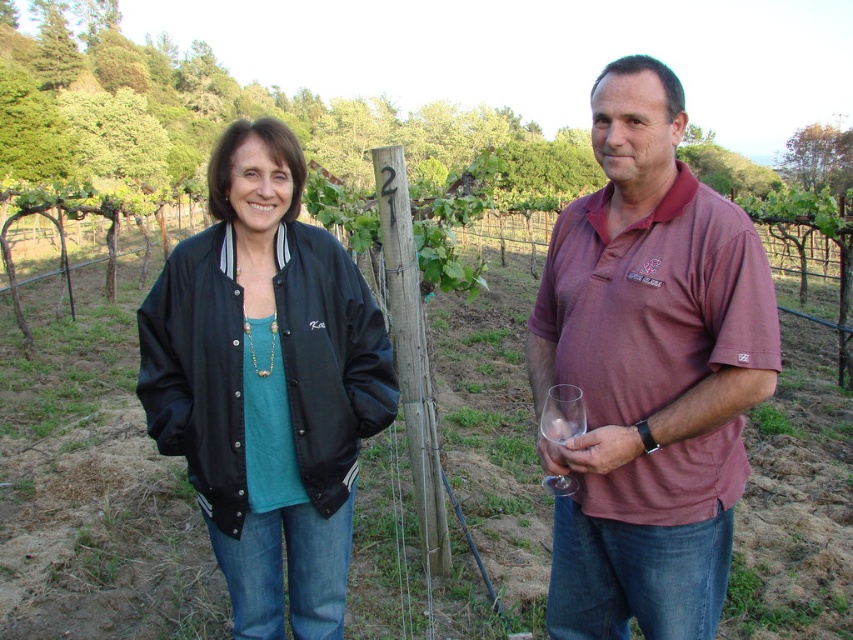
You are standing at the point with coordinates point (170, 332) and want to walk to the point with coordinates point (630, 348). According to the scene, will you need to walk towards the foreground or the background?

You need to walk towards the background because point (630, 348) is in front of point (170, 332), meaning it is closer to the viewer. Since you are at point (170, 332), which is behind point (630, 348), you would need to walk towards the background to reach it.

You are a photographer positioned in front of the vineyard scene. You notice the black leather jacket at left and the clear glass at right. Which object is nearer to your camera lens?

The black leather jacket at left is closer to the viewer than the clear glass at right, so the black leather jacket at left is nearer to the camera lens.

You are a photographer positioned at the center of the image. You need to capture a photo where the black leather jacket at left is centered in the frame. Which direction should you move the camera to align the jacket with the center?

The black leather jacket at left is already at position coordinates approximately 0.583 on the x and 0.761 on the y. Since the photographer is at the center, moving the camera slightly to the right and upwards would align the jacket with the frame center.